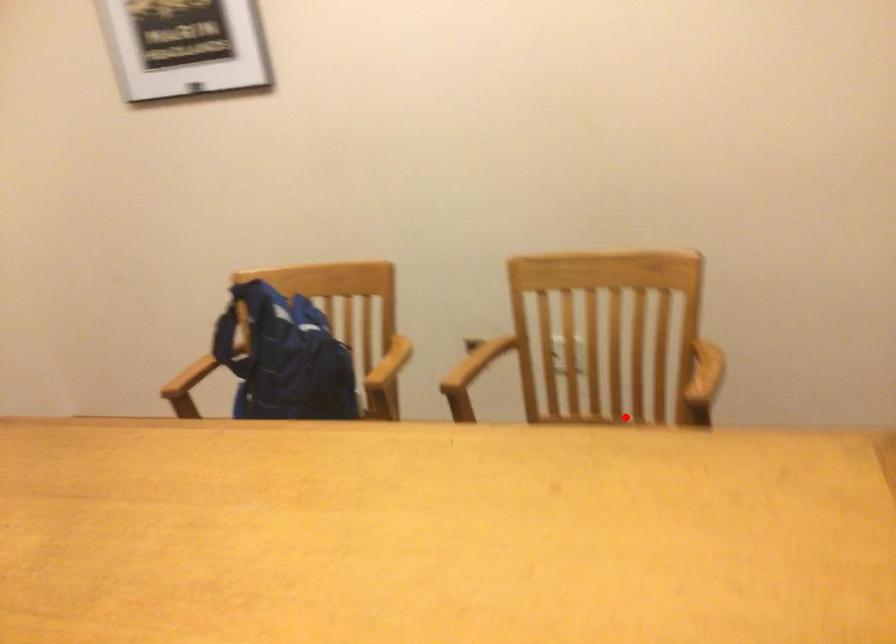
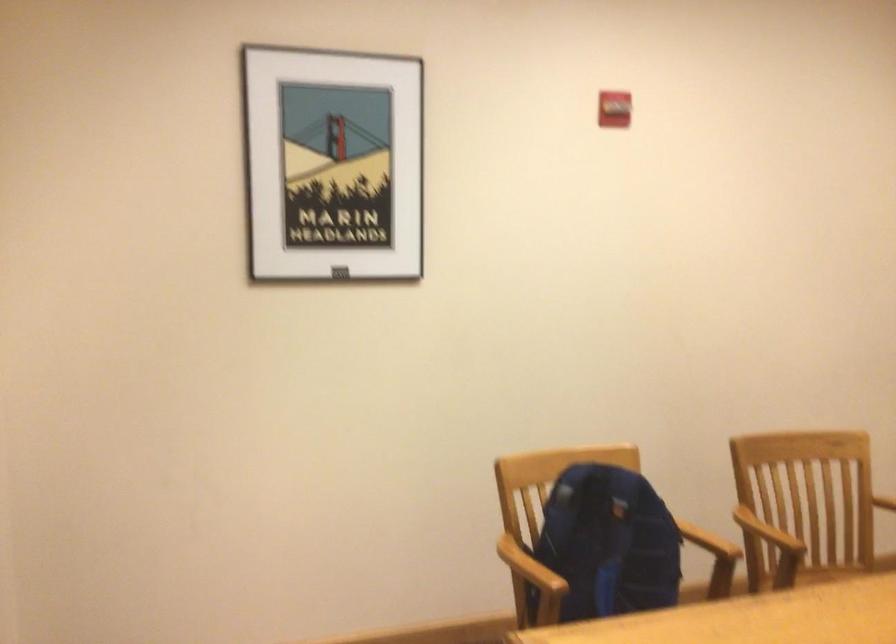
Question: I am providing you with two images of the same scene from different viewpoints. Given a red point in image1, look at the same physical point in image2. Is it:

Choices:
 (A) Closer to the viewpoint
 (B) Farther from the viewpoint

Answer: (B)